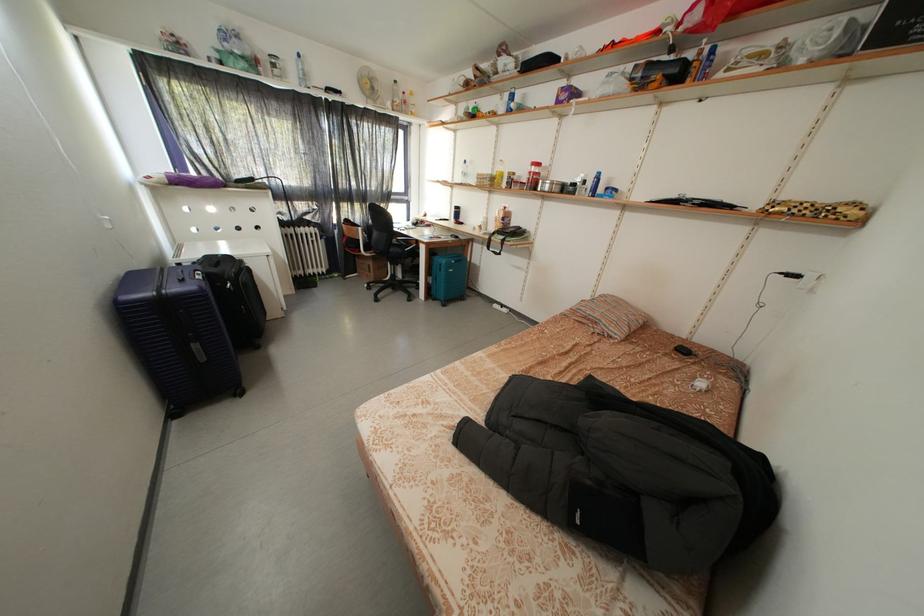
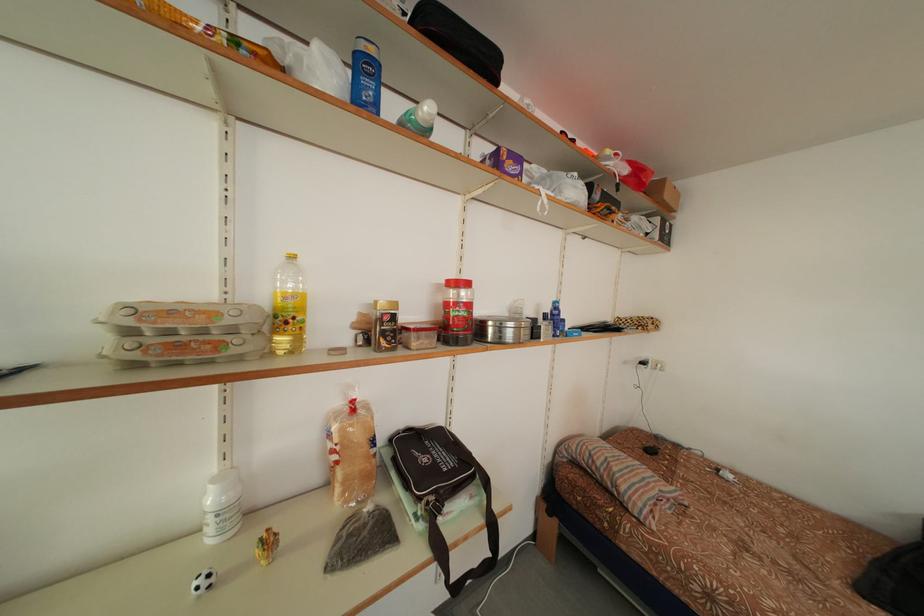
Where in the second image is the point corresponding to [592,188] from the first image?

(553, 322)